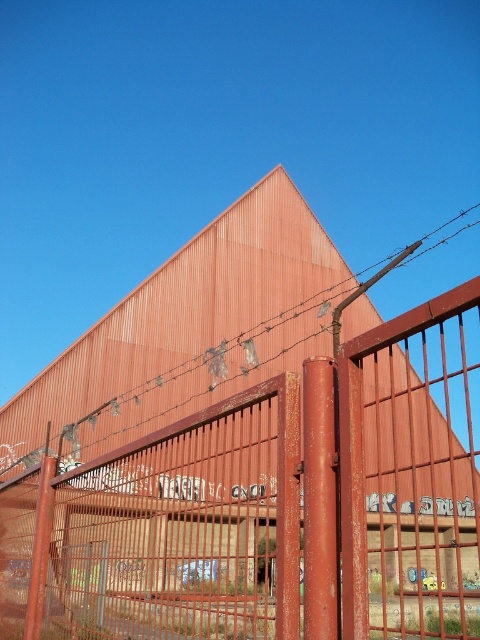
Where is `rusty metal gate at center`? rusty metal gate at center is located at coordinates [273, 506].

Does rusty metal gate at center have a smaller size compared to rusty wire at center?

Correct, rusty metal gate at center occupies less space than rusty wire at center.

Is point (380, 369) positioned before point (288, 308)?

That is False.

Where is `rusty metal gate at center`? rusty metal gate at center is located at coordinates (273, 506).